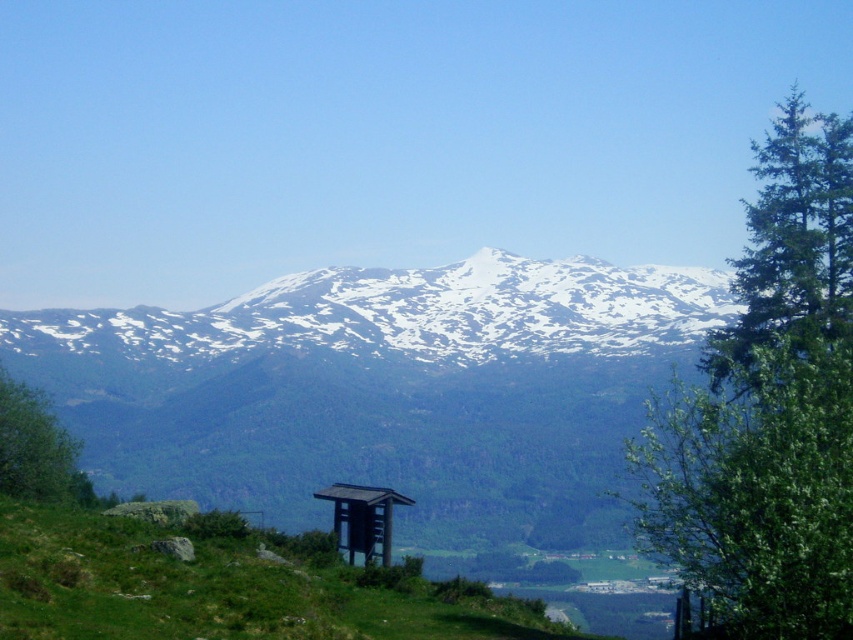
Question: Is green grassy hillside at lower center above green leafy tree at lower left?

Choices:
 (A) yes
 (B) no

Answer: (B)

Question: Where is white snow-covered mountain range at center located in relation to brown wooden gazebo at center in the image?

Choices:
 (A) left
 (B) right

Answer: (A)

Question: Which point appears farthest from the camera in this image?

Choices:
 (A) (90, 328)
 (B) (4, 541)

Answer: (A)

Question: Considering the real-world distances, which object is farthest from the green leafy tree at right?

Choices:
 (A) green grassy hillside at lower center
 (B) green leafy tree at lower left
 (C) white snow-covered mountain range at center

Answer: (C)

Question: Which of these objects is positioned closest to the green leafy tree at lower left?

Choices:
 (A) green leafy tree at right
 (B) brown wooden gazebo at center
 (C) green grassy hillside at lower center
 (D) white snow-covered mountain range at center

Answer: (B)

Question: Can you confirm if green leafy tree at right is thinner than white snow-covered mountain range at center?

Choices:
 (A) no
 (B) yes

Answer: (B)